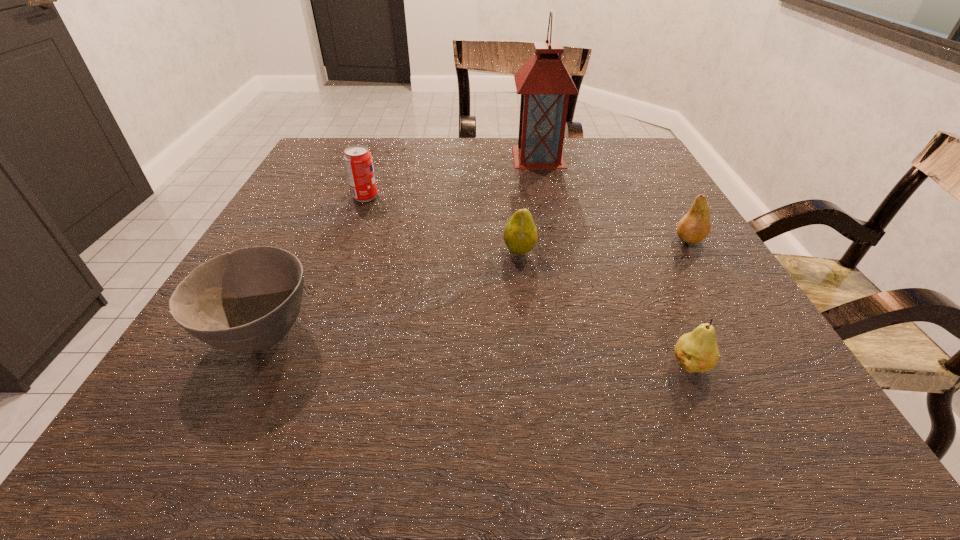
Find the location of `vacant space that satisfies the following two spatial constraints: 1. on the front side of the tallest object; 2. on the left side of the second pear from right to left`. vacant space that satisfies the following two spatial constraints: 1. on the front side of the tallest object; 2. on the left side of the second pear from right to left is located at coordinates (584, 364).